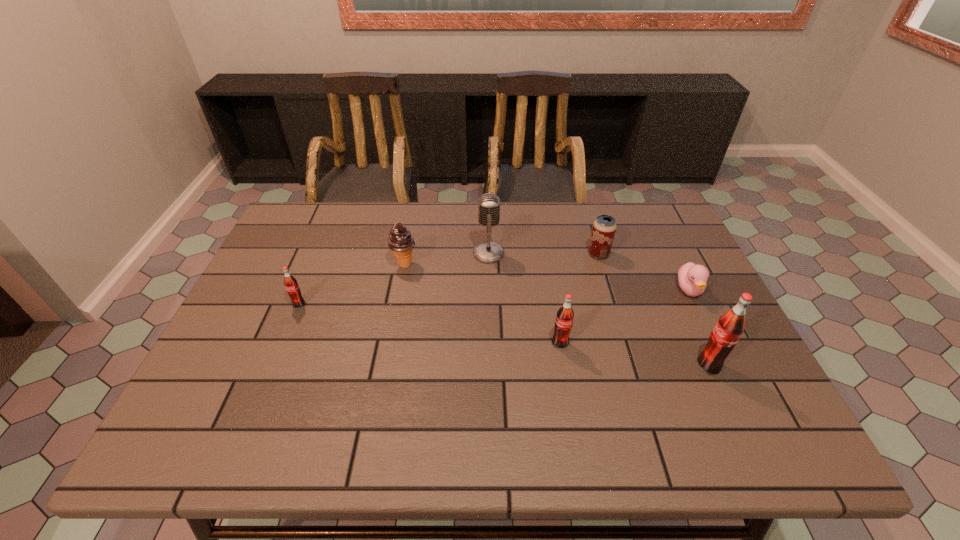
You are a GUI agent. You are given a task and a screenshot of the screen. Output one action in this format:
    pyautogui.click(x=<x>, y=<y>)
    Task: Click on the farthest soda bottle
    The height and width of the screenshot is (540, 960).
    Given the screenshot: What is the action you would take?
    click(291, 285)

Where is `the leftmost object`? Image resolution: width=960 pixels, height=540 pixels. the leftmost object is located at coordinates (291, 285).

This screenshot has height=540, width=960. I want to click on the second nearest object, so [x=564, y=319].

The width and height of the screenshot is (960, 540). What are the coordinates of `the second tallest soda bottle` in the screenshot? It's located at [x=564, y=319].

Identify the location of the rightmost soda bottle. (730, 326).

The height and width of the screenshot is (540, 960). I want to click on the nearest soda bottle, so click(x=730, y=326).

You are a GUI agent. You are given a task and a screenshot of the screen. Output one action in this format:
    pyautogui.click(x=<x>, y=<y>)
    Task: Click on the fifth object from left to right
    
    Given the screenshot: What is the action you would take?
    pyautogui.click(x=604, y=227)

Find the location of a particular element. the fifth object from right to left is located at coordinates (488, 252).

Find the location of `icecream`. icecream is located at coordinates (400, 241).

The height and width of the screenshot is (540, 960). Identify the location of duckling. (692, 278).